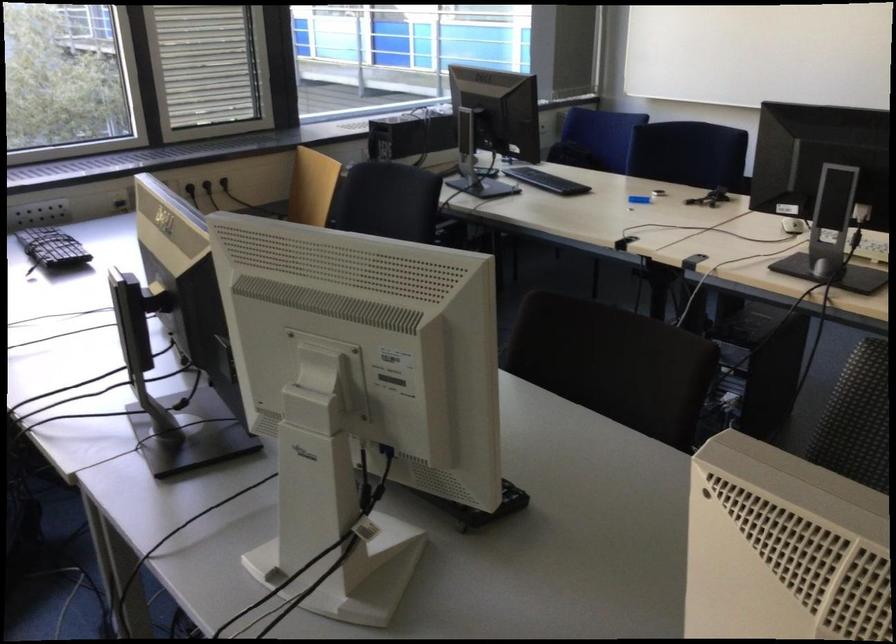
Describe the element at coordinates (312, 187) in the screenshot. Image resolution: width=896 pixels, height=644 pixels. I see `the wooden chair sitting surface` at that location.